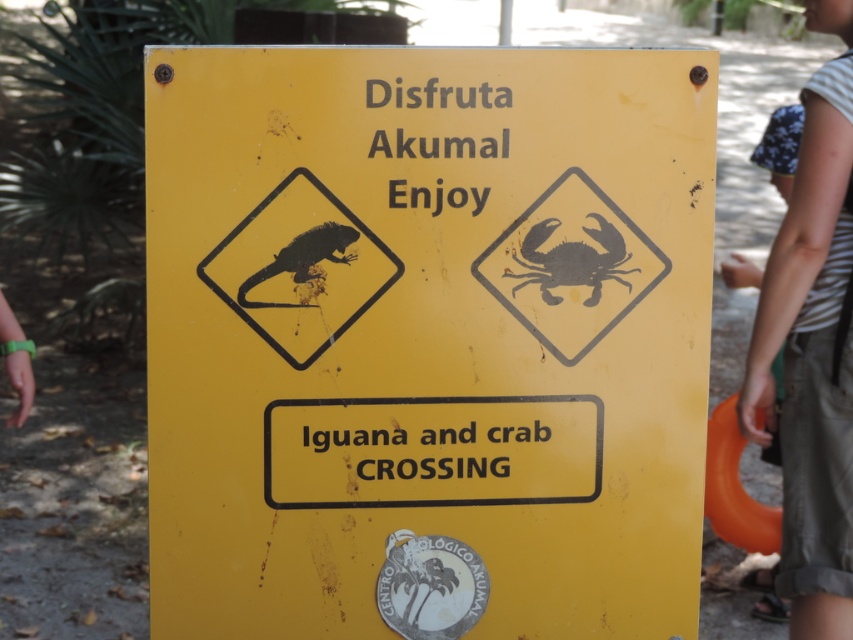
Does striped fabric shirt at upper right have a lesser width compared to black matte crab at upper right?

No.

Does point (821, 84) lie behind point (596, 234)?

Yes, point (821, 84) is farther from viewer.

Locate an element on the screen. This screenshot has height=640, width=853. striped fabric shirt at upper right is located at coordinates (811, 349).

Is yellow matte sign at center above matte black iguana at upper left?

Actually, yellow matte sign at center is below matte black iguana at upper left.

Identify the location of yellow matte sign at center. (425, 344).

Which is more to the right, striped fabric shirt at upper right or matte black iguana at upper left?

From the viewer's perspective, striped fabric shirt at upper right appears more on the right side.

Does striped fabric shirt at upper right have a greater height compared to matte black iguana at upper left?

Indeed, striped fabric shirt at upper right has a greater height compared to matte black iguana at upper left.

Who is more distant from viewer, (821, 125) or (343, 227)?

Positioned behind is point (821, 125).

Locate an element on the screen. This screenshot has height=640, width=853. striped fabric shirt at upper right is located at coordinates (811, 349).